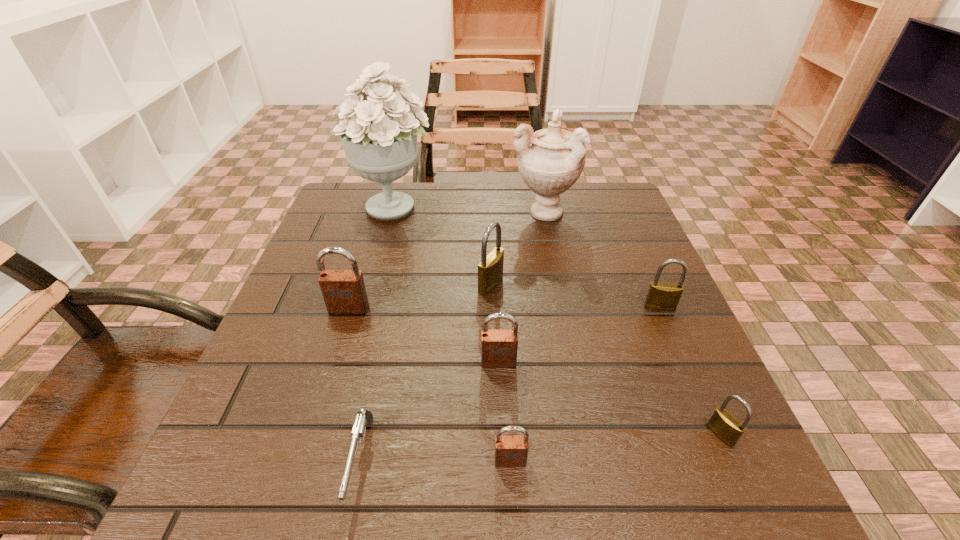
Find the location of a particular element. vacant region located on the front-facing side of the biggest brown padlock is located at coordinates (319, 406).

Identify the location of vacant space situated 0.050m on the back of the second smallest brass padlock. (x=650, y=286).

Identify the location of vacant space located 0.200m on the front-facing side of the third nearest padlock. The height and width of the screenshot is (540, 960). (504, 487).

In order to click on free space located 0.150m on the left of the smallest brass padlock in this screenshot , I will do `click(611, 435)`.

Image resolution: width=960 pixels, height=540 pixels. Find the location of `free space located on the front-facing side of the nearest brown padlock`. free space located on the front-facing side of the nearest brown padlock is located at coordinates (514, 512).

In order to click on bouquet at the far edge in this screenshot , I will do `click(382, 147)`.

Locate an element on the screen. urn that is at the far edge is located at coordinates (550, 161).

At what (x,y) coordinates should I click in order to perform the action: click on padlock that is at the near edge. Please return your answer as a coordinate pair (x, y). Looking at the image, I should click on (510, 451).

The height and width of the screenshot is (540, 960). I want to click on pistol present at the near edge, so click(364, 417).

The image size is (960, 540). In order to click on bouquet located at the left edge in this screenshot , I will do `click(382, 147)`.